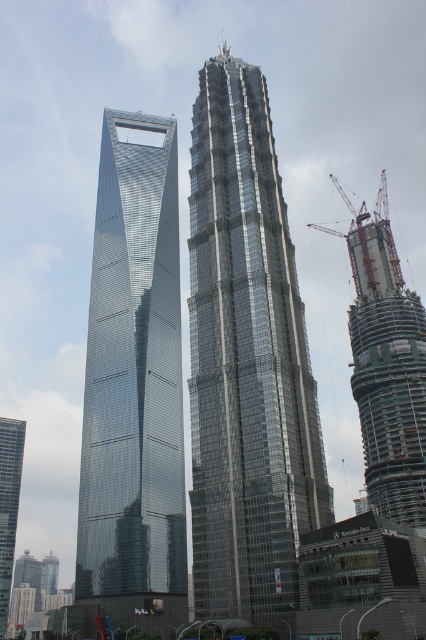
This screenshot has width=426, height=640. Find the location of `shiny glass skyscraper at left`. shiny glass skyscraper at left is located at coordinates (134, 385).

Between point (143, 291) and point (6, 518), which one is positioned behind?

Positioned behind is point (6, 518).

At what (x,y) coordinates should I click in order to perform the action: click on shiny glass skyscraper at left. Please return your answer as a coordinate pair (x, y). Image resolution: width=426 pixels, height=640 pixels. Looking at the image, I should click on [x=134, y=385].

Where is `shiny glass skyscraper at left`? shiny glass skyscraper at left is located at coordinates (134, 385).

Can you confirm if shiny glass skyscraper at center is positioned above concrete construction at right?

No.

Is shiny glass skyscraper at center positioned behind concrete construction at right?

No, shiny glass skyscraper at center is closer to the viewer.

Which is behind, point (219, 502) or point (360, 429)?

Point (360, 429)

Identify the location of shiny glass skyscraper at center. The width and height of the screenshot is (426, 640). (247, 362).

Based on the photo, who is lower down, concrete construction at right or metallic construction crane at right?

Positioned lower is concrete construction at right.

Between point (408, 291) and point (365, 256), which one is positioned in front?

Positioned in front is point (408, 291).

Measure the distance between concrete construction at right and camera.

concrete construction at right is 114.70 meters from camera.

The image size is (426, 640). I want to click on concrete construction at right, so click(386, 365).